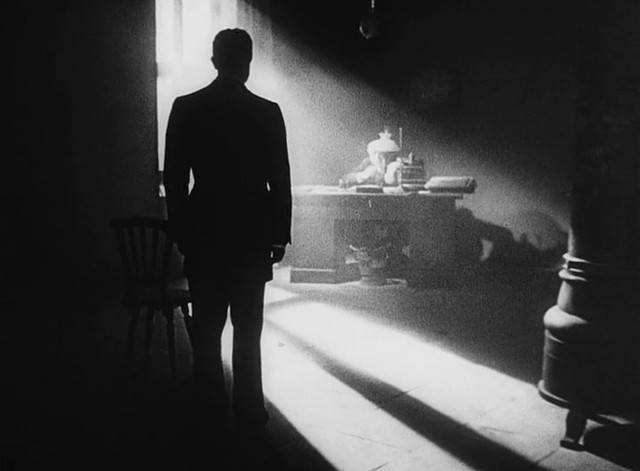
Where is `floor`? floor is located at coordinates [444, 333], [328, 395].